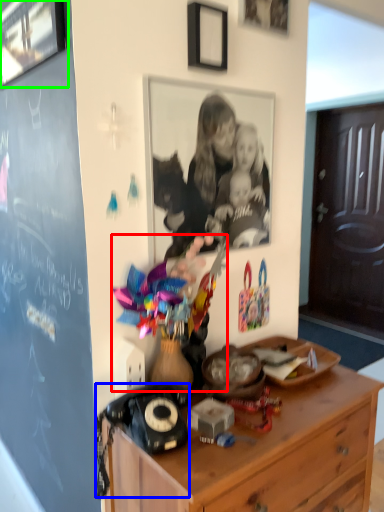
Question: Considering the real-world distances, which object is farthest from toy (highlighted by a red box)? corded phone (highlighted by a blue box) or picture frame (highlighted by a green box)?

Choices:
 (A) corded phone
 (B) picture frame

Answer: (B)